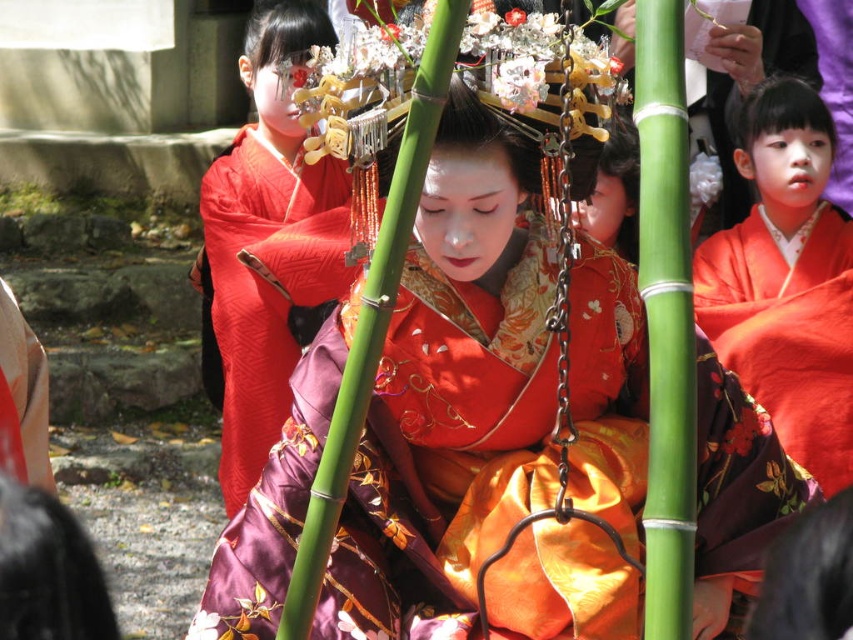
Does point (260, 44) come behind point (792, 332)?

Yes, it is behind point (792, 332).

The image size is (853, 640). What do you see at coordinates (265, 244) in the screenshot?
I see `silky red kimono at center` at bounding box center [265, 244].

Where is `silky red kimono at center`? This screenshot has height=640, width=853. silky red kimono at center is located at coordinates (265, 244).

In the scene shown: Who is shorter, satin kimono at center or silky orange kimono at right?

satin kimono at center is shorter.

Between satin kimono at center and silky orange kimono at right, which one has more height?

silky orange kimono at right is taller.

Describe the element at coordinates (451, 396) in the screenshot. I see `satin kimono at center` at that location.

This screenshot has width=853, height=640. I want to click on satin kimono at center, so click(451, 396).

Between satin kimono at center and silky red kimono at center, which one appears on the left side from the viewer's perspective?

silky red kimono at center is more to the left.

Which is in front, point (444, 157) or point (283, 358)?

Point (444, 157) is in front.

Image resolution: width=853 pixels, height=640 pixels. Find the location of `satin kimono at center`. satin kimono at center is located at coordinates (451, 396).